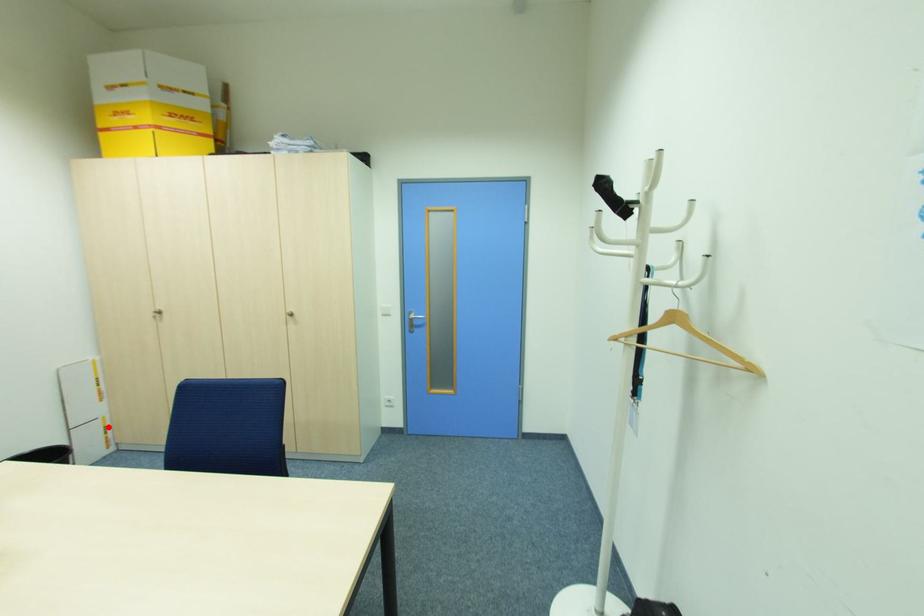
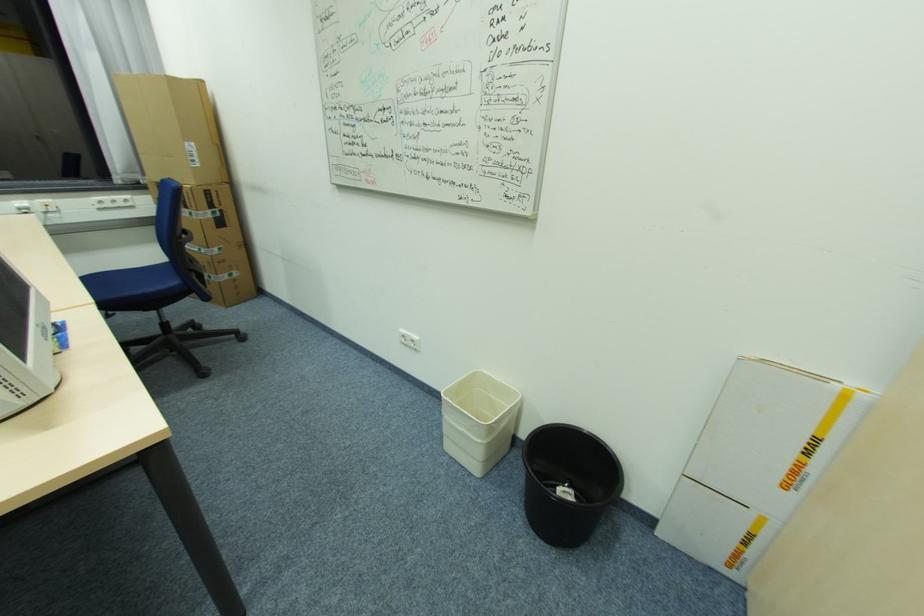
Question: A red point is marked in image1. In image2, is the corresponding 3D point closer to the camera or farther? Reply with the corresponding letter.

Choices:
 (A) The corresponding 3D point is closer.
 (B) The corresponding 3D point is farther.

Answer: (A)